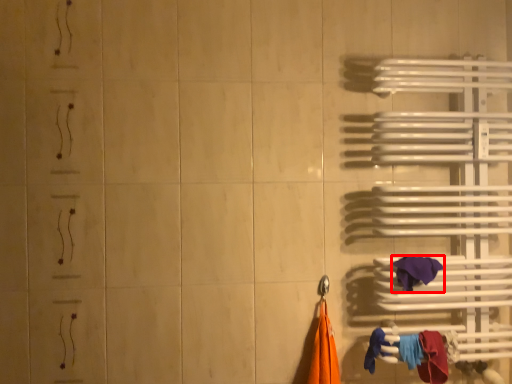
Question: From the image's perspective, what is the correct spatial positioning of towel (annotated by the red box) in reference to towel?

Choices:
 (A) below
 (B) above

Answer: (B)